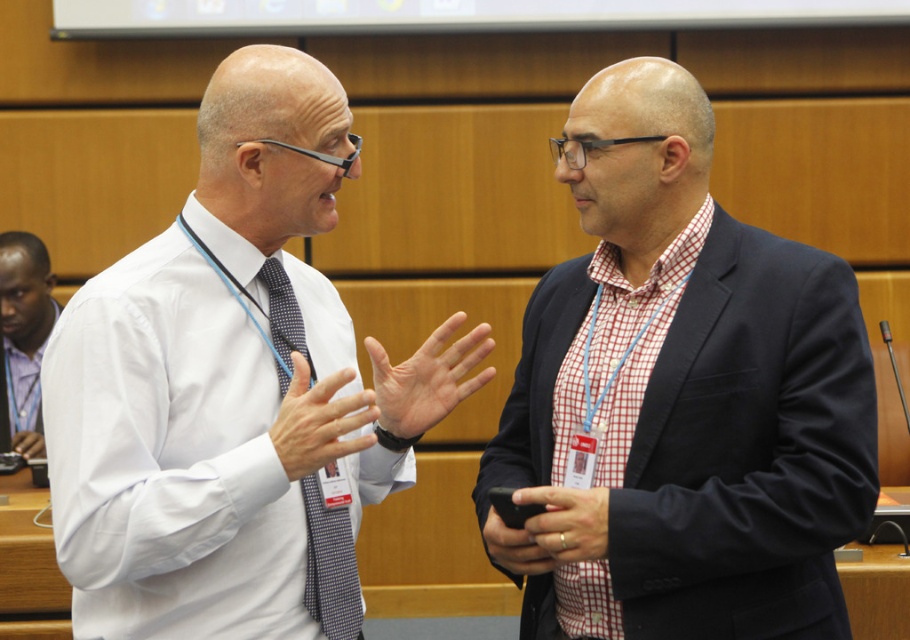
You are organizing a photo shoot and need to ensure that the two central items in the scene, the red checkered shirt at center and the matte blue checkered tie at center, are framed properly. Based on their sizes, which item should you prioritize positioning first to avoid overcrowding the frame?

The red checkered shirt at center might be wider than the matte blue checkered tie at center, so you should prioritize positioning the red checkered shirt at center first to ensure it fits well in the frame.

In the conference room scene, there are two people. The first person is wearing a white dress shirt with a dark blue tie, and the second person is wearing a dark blazer over a red and white checkered shirt. A point has been marked at coordinates (681,397). Which object does this point correspond to?

The point at coordinates (681,397) marks the red checkered shirt at center.